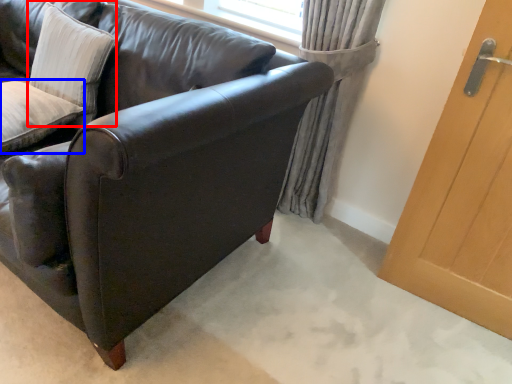
Question: Which of the following is the closest to the observer, pillow (highlighted by a red box) or pillow (highlighted by a blue box)?

Choices:
 (A) pillow
 (B) pillow

Answer: (B)